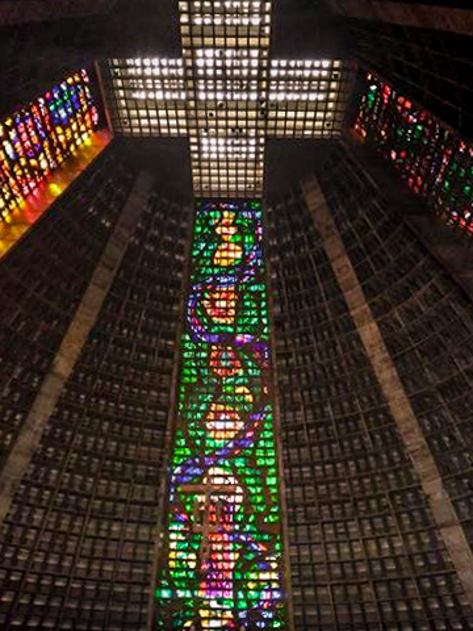
Find the location of a particular element. This screenshot has height=631, width=473. columns is located at coordinates (316, 198), (386, 378), (425, 464), (456, 546), (11, 467), (104, 283), (126, 226).